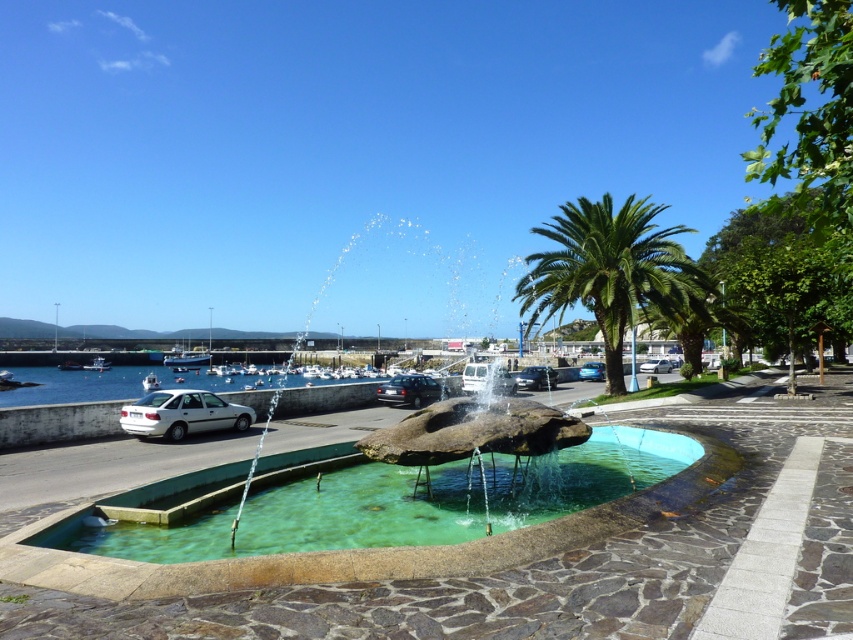
Question: Is satin black car at center positioned behind silver metallic van at center?

Choices:
 (A) no
 (B) yes

Answer: (A)

Question: Is green stone pool at center positioned behind green stone fountain at center?

Choices:
 (A) no
 (B) yes

Answer: (B)

Question: Among these points, which one is farthest from the camera?

Choices:
 (A) (144, 380)
 (B) (108, 368)
 (C) (149, 419)

Answer: (B)

Question: Does matte silver sedan at center appear on the right side of white plastic boat at left?

Choices:
 (A) no
 (B) yes

Answer: (B)

Question: Which point is farther from the camera taking this photo?

Choices:
 (A) (171, 353)
 (B) (381, 387)
 (C) (148, 381)

Answer: (A)

Question: Among these points, which one is farthest from the camera?

Choices:
 (A) (91, 362)
 (B) (436, 394)
 (C) (244, 406)
 (D) (207, 353)

Answer: (D)